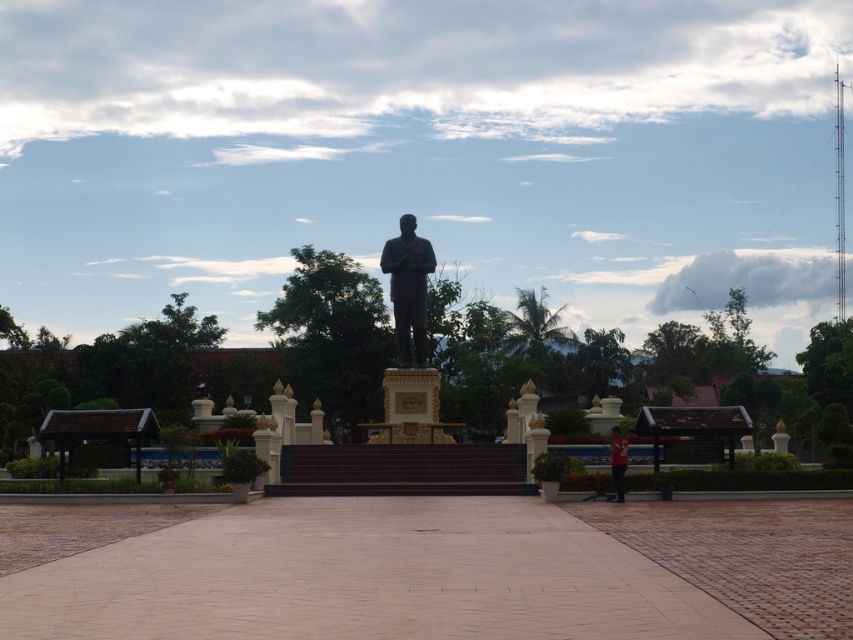
Based on the photo, does black polished statue at center have a lesser width compared to bronze statue at center?

No, black polished statue at center is not thinner than bronze statue at center.

Between black polished statue at center and bronze statue at center, which one appears on the left side from the viewer's perspective?

From the viewer's perspective, bronze statue at center appears more on the left side.

Describe the element at coordinates (409, 332) in the screenshot. The width and height of the screenshot is (853, 640). I see `black polished statue at center` at that location.

At what (x,y) coordinates should I click in order to perform the action: click on black polished statue at center. Please return your answer as a coordinate pair (x, y). Looking at the image, I should click on (409, 332).

Which is above, bronze statue at center or red fabric shirt at lower right?

bronze statue at center

Measure the distance from bronze statue at center to red fabric shirt at lower right.

The distance of bronze statue at center from red fabric shirt at lower right is 9.09 meters.

Measure the distance between point (419, 307) and camera.

The distance of point (419, 307) from camera is 173.06 feet.

Locate an element on the screen. This screenshot has height=640, width=853. bronze statue at center is located at coordinates (408, 288).

Is black polished statue at center behind red fabric shirt at lower right?

Yes.

Does black polished statue at center come in front of red fabric shirt at lower right?

That is False.

This screenshot has width=853, height=640. Describe the element at coordinates (409, 332) in the screenshot. I see `black polished statue at center` at that location.

Find the location of a particular element. Image resolution: width=853 pixels, height=640 pixels. black polished statue at center is located at coordinates (409, 332).